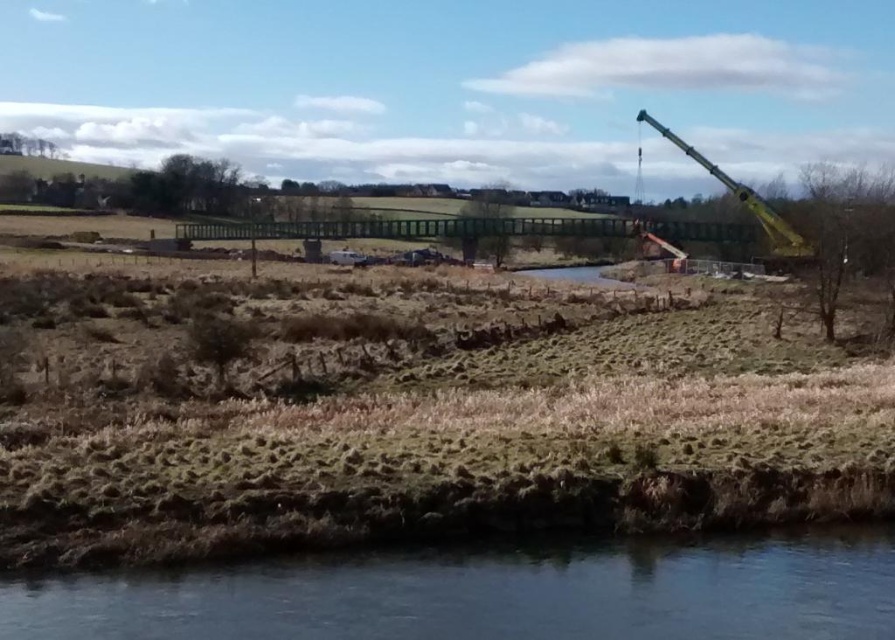
You are standing at the construction site near the water and want to walk from the crane to the orange shed. The crane is at point (188, 592) and the shed is at point (727, 177). Which point do you need to walk towards first?

You need to walk towards point (188, 592) first because it is in front of point (727, 177), meaning it is closer to your current position at the construction site.

In the scene shown: You are standing at the clear water at lower left and want to reach the orange structure on the right. The construction site has a safety rule that you must stay at least 30 feet away from any equipment. Can you safely walk directly to the orange structure without violating the rule?

The distance between you and the orange structure is 34.38 feet, which is more than the required 30 feet safety distance. Therefore, you can safely walk directly to the orange structure without violating the rule.

You are a surveyor standing at the origin point of the coordinate system located at the bottom left corner of the image. You need to locate the yellow metallic crane at upper right. What are its coordinates?

The coordinates of the yellow metallic crane at upper right are at point [748,205].